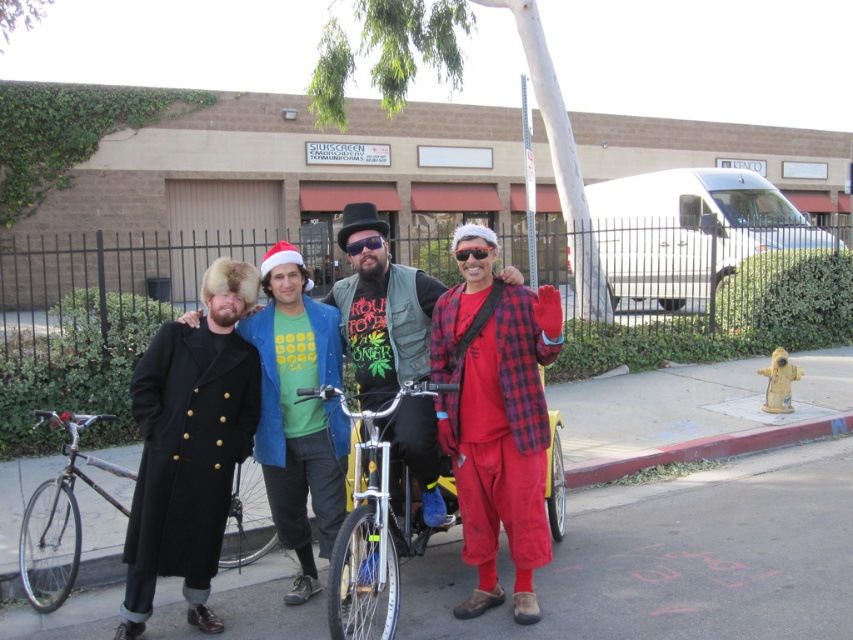
You are a photographer standing 5 meters away from the group. You want to take a photo of the red flannel shirt at center and the person wearing a long black coat with gold buttons on the left. How far apart should you position them in your photo to ensure they are both in focus?

The red flannel shirt at center and the person wearing a long black coat with gold buttons on the left are 3.62 meters apart. To ensure both are in focus, the photographer should position them within the depth of field of the camera lens, considering the distance of 5 meters and the 3.62 meters between them.

Based on the scene description, where is the red flannel shirt at center located in the image?

The red flannel shirt at center is located at point 0.656 on the x axis and 0.583 on the y axis.

You are a photographer setting up for a group photo. You have two silver bicycles in the frame. The silver metallic bicycle at center and the shiny silver bicycle at left. You want to ensure both bicycles are visible in the photo. Based on their positions, which bicycle is closer to the camera?

The shiny silver bicycle at left is closer to the camera because the silver metallic bicycle at center is positioned above it, indicating it is further away.